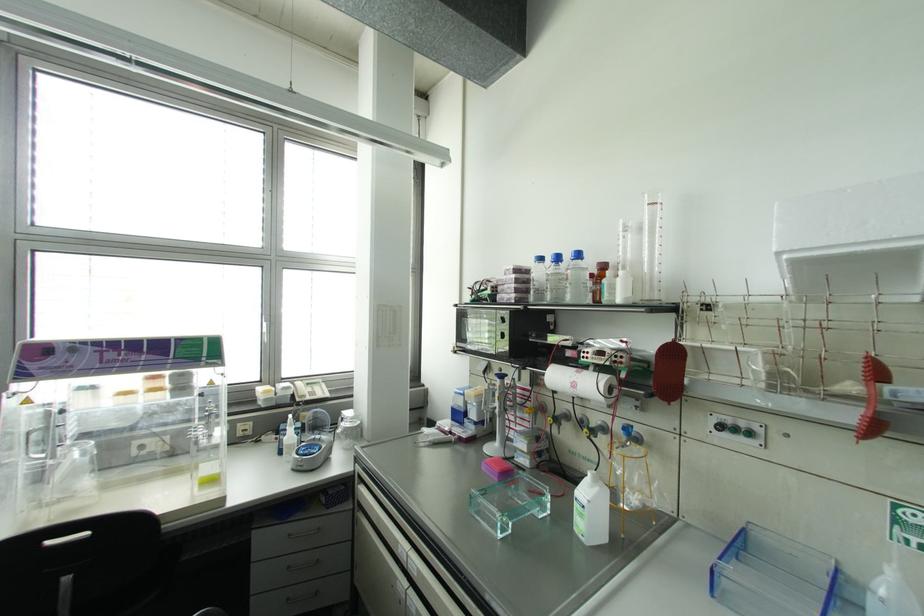
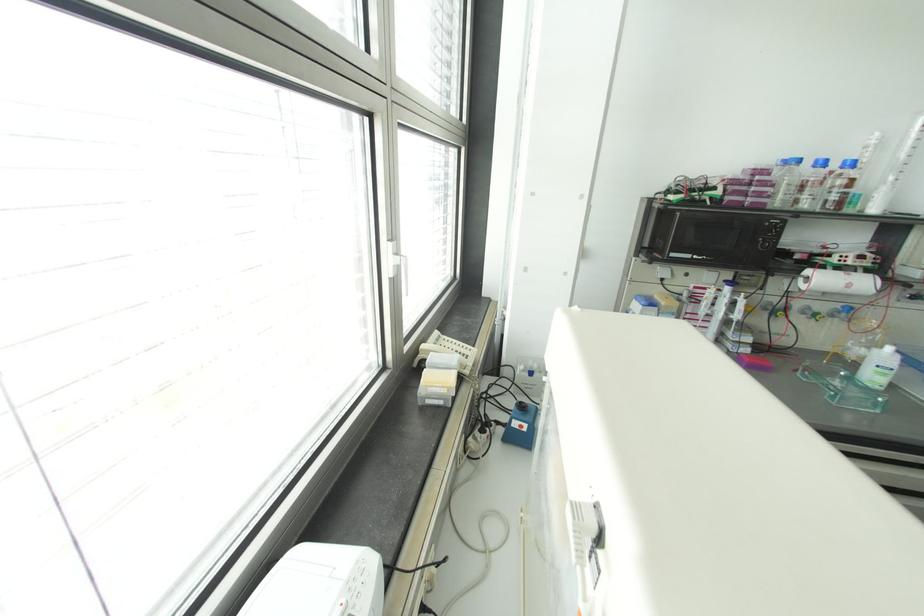
Find the pixel in the second image that matches (x=626, y=429) in the first image.

(848, 309)